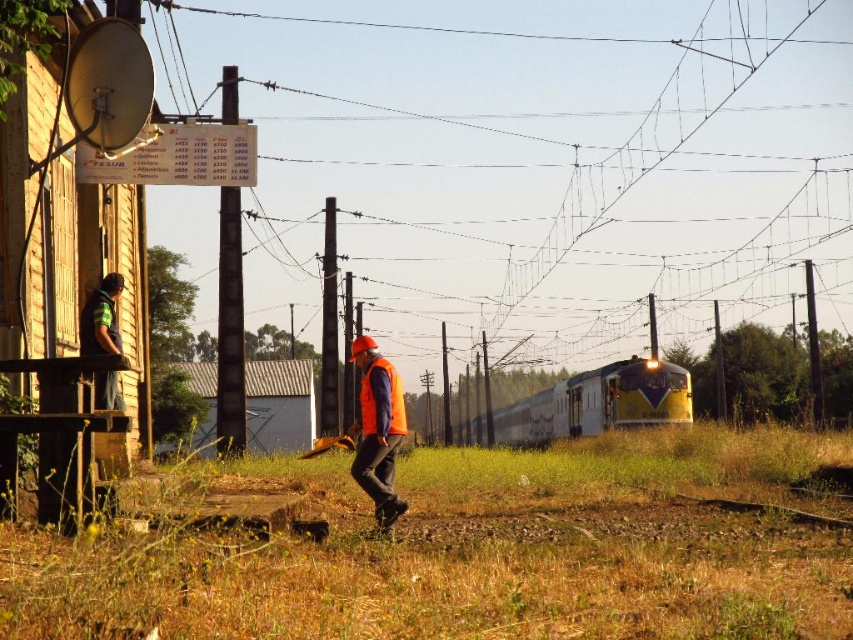
Question: Can you confirm if yellow metallic train at center is positioned below orange reflective vest at center?

Choices:
 (A) no
 (B) yes

Answer: (B)

Question: Among these objects, which one is nearest to the camera?

Choices:
 (A) orange reflective vest at center
 (B) orange matte safety vest at center

Answer: (A)

Question: Is yellow metallic train at center thinner than orange reflective vest at center?

Choices:
 (A) no
 (B) yes

Answer: (A)

Question: Which object is closer to the camera taking this photo?

Choices:
 (A) yellow metallic train at center
 (B) orange reflective vest at center

Answer: (B)

Question: Which is farther from the yellow metallic train at center?

Choices:
 (A) orange matte safety vest at center
 (B) orange reflective vest at center

Answer: (A)

Question: Does yellow metallic train at center have a greater width compared to orange reflective vest at center?

Choices:
 (A) no
 (B) yes

Answer: (B)